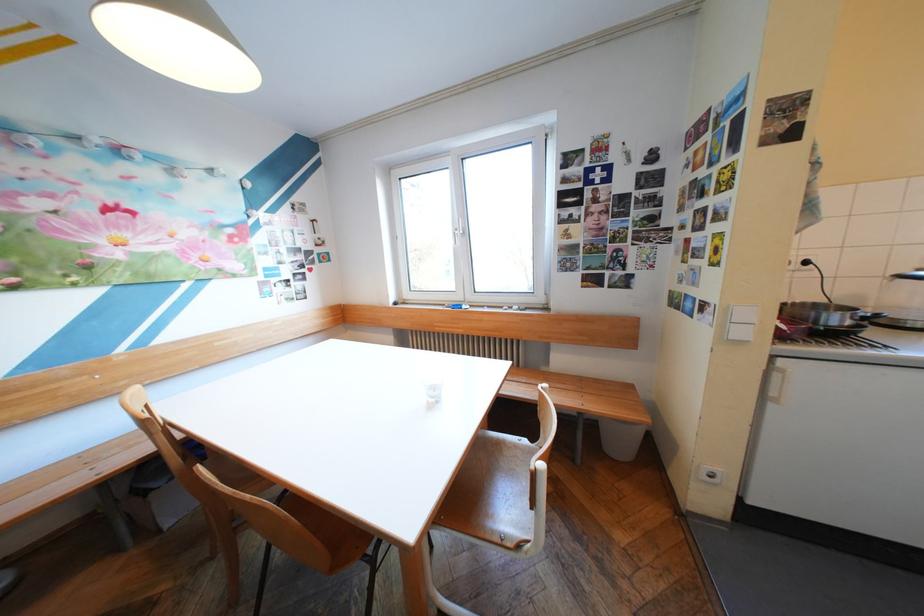
Locate an element on the screen. white cabinet handle is located at coordinates (775, 383).